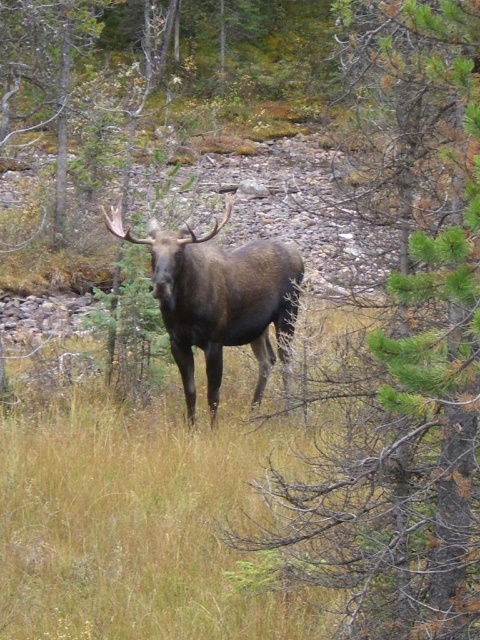
You are a hiker who wants to take a photo of the brown furry moose at center without including the green leafy tree at center in the background. Which direction should you move to achieve this?

Move to the left side of the brown furry moose at center so that the green leafy tree at center, which is to the right of the moose, is no longer in the background.

You are a hiker trying to navigate through the forest. You have two landmarks marked on your map as point coordinates. The first is point (x=398, y=604) and the second is point (x=277, y=320). According to the image, which point is closer to you?

Point (x=398, y=604) is in front of point (x=277, y=320), so it is closer to you.

You are a hiker trying to take a photo of the brown furry moose at center. You notice a green leafy tree at center in the way. Is the tree blocking the moose?

The green leafy tree at center is below the brown furry moose at center, so the tree is not blocking the moose. You can take the photo without any obstruction.